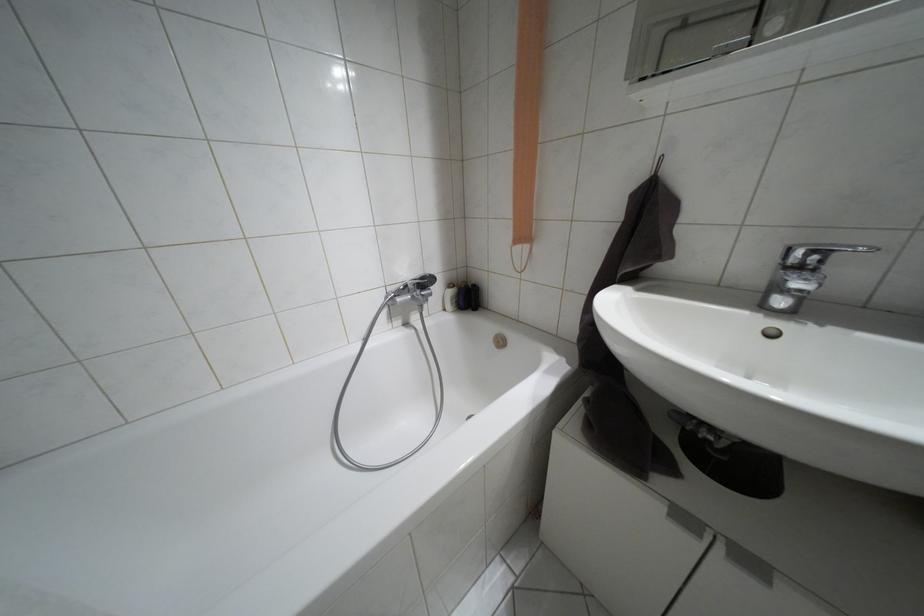
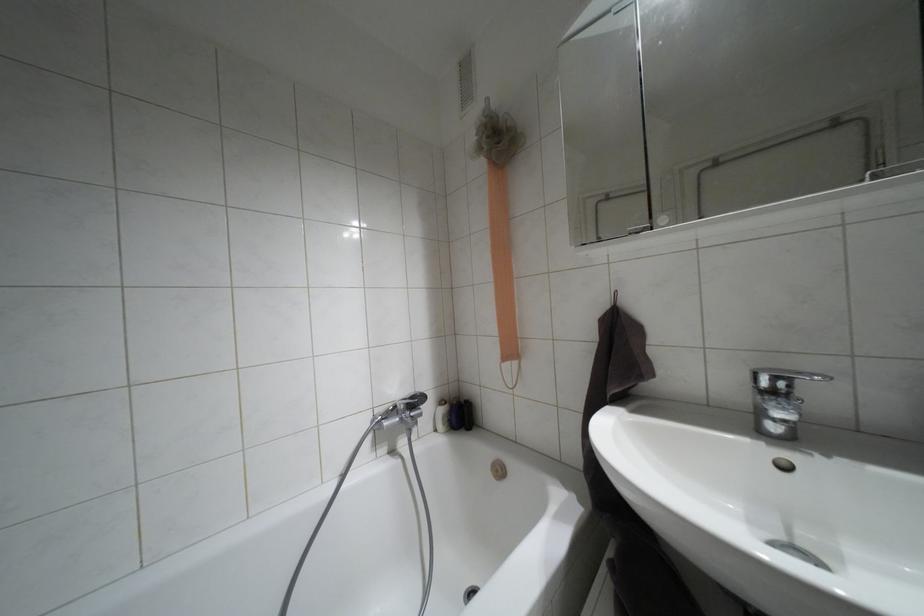
Question: Based on the continuous images, in which direction is the camera rotating? Reply with the corresponding letter.

Choices:
 (A) Left
 (B) Right
 (C) Up
 (D) Down

Answer: (C)